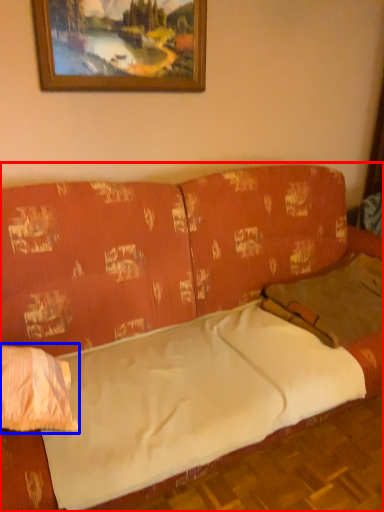
Question: Among these objects, which one is nearest to the camera, studio couch (highlighted by a red box) or pillow (highlighted by a blue box)?

Choices:
 (A) studio couch
 (B) pillow

Answer: (A)